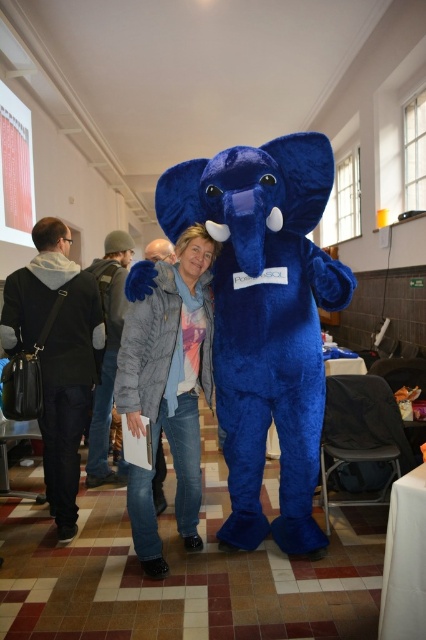
Describe the element at coordinates (265, 317) in the screenshot. I see `blue plush elephant at center` at that location.

The width and height of the screenshot is (426, 640). I want to click on blue plush elephant at center, so click(265, 317).

What do you see at coordinates (265, 317) in the screenshot? I see `blue plush elephant at center` at bounding box center [265, 317].

Where is `blue plush elephant at center`? Image resolution: width=426 pixels, height=640 pixels. blue plush elephant at center is located at coordinates (265, 317).